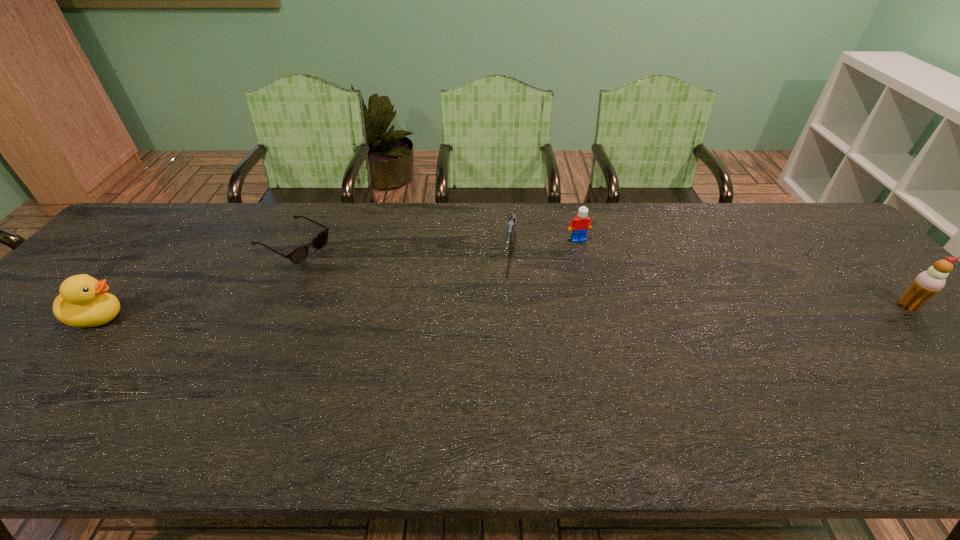
What are the coordinates of `vacant area located 0.390m at the barrel of the third object from left to right` in the screenshot? It's located at point(490,401).

Identify the location of vacant region located 0.060m at the barrel of the third object from left to right. This screenshot has width=960, height=540. (508, 293).

Locate an element on the screen. This screenshot has height=540, width=960. free space located 0.050m on the front lenses of the shortest object is located at coordinates (331, 265).

Find the location of a particular element. This screenshot has height=540, width=960. vacant area located 0.320m on the front lenses of the shortest object is located at coordinates (405, 302).

The image size is (960, 540). I want to click on free space located on the front lenses of the shortest object, so (368, 283).

Where is `free region located 0.190m on the face of the second object from right to left`? free region located 0.190m on the face of the second object from right to left is located at coordinates (602, 287).

This screenshot has height=540, width=960. In order to click on vacant space located 0.150m on the face of the second object from right to left in this screenshot , I will do `click(597, 276)`.

The height and width of the screenshot is (540, 960). I want to click on vacant space located on the face of the second object from right to left, so click(x=595, y=274).

Locate an element on the screen. Image resolution: width=960 pixels, height=540 pixels. gun located in the far edge section of the desktop is located at coordinates (512, 220).

Identify the location of sunglasses that is at the far edge. (298, 255).